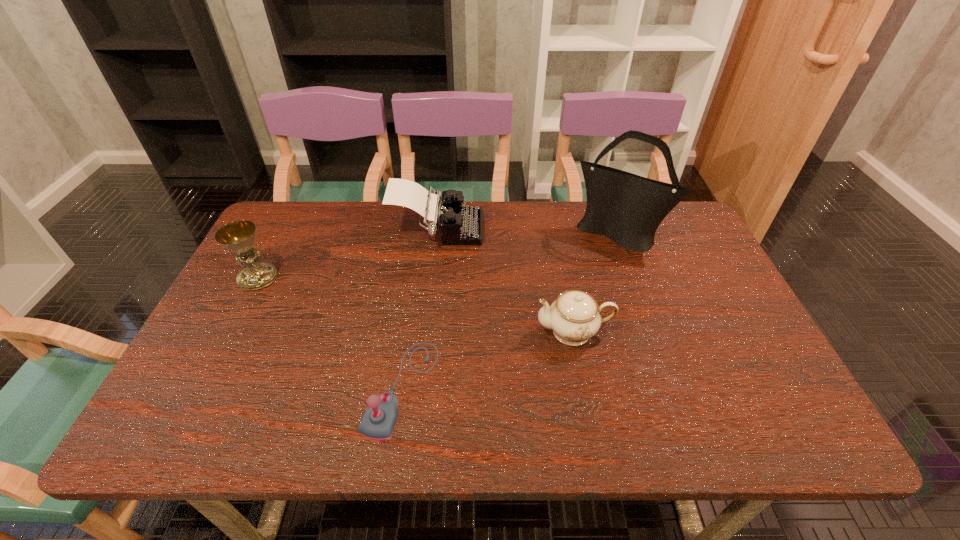
The image size is (960, 540). In order to click on vacant space at the near edge of the desktop in this screenshot , I will do `click(715, 433)`.

In the image, there is a desktop. Where is `free region at the left edge`? free region at the left edge is located at coordinates (257, 313).

Locate an element on the screen. This screenshot has width=960, height=540. blank space at the far left corner is located at coordinates (278, 217).

Find the location of a particular element. Image resolution: width=960 pixels, height=540 pixels. vacant region at the far right corner of the desktop is located at coordinates (659, 242).

Image resolution: width=960 pixels, height=540 pixels. In order to click on empty space between the joystick and the third farthest object in this screenshot , I will do `click(330, 333)`.

This screenshot has width=960, height=540. Identify the location of free space between the tallest object and the chinaware. (596, 283).

Where is `free point between the leftmost object and the chinaware`? Image resolution: width=960 pixels, height=540 pixels. free point between the leftmost object and the chinaware is located at coordinates (416, 305).

Find the location of a particular element. The height and width of the screenshot is (540, 960). vacant point located between the third nearest object and the shoulder bag is located at coordinates (438, 256).

Identify the location of vacant region between the shoulder bag and the chalice. The height and width of the screenshot is (540, 960). (438, 256).

Identify the location of vacant space that is in between the typewriter and the chinaware. Image resolution: width=960 pixels, height=540 pixels. (505, 281).